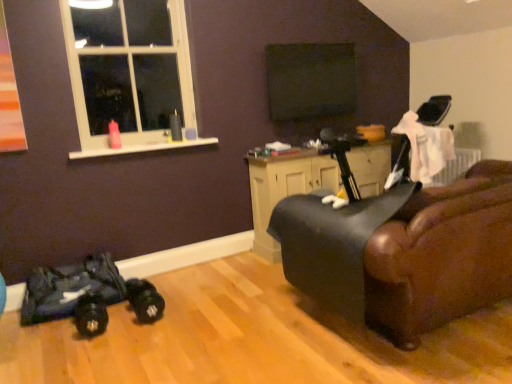
Question: Is black matte screen at upper center looking in the opposite direction of white plastic window at upper left?

Choices:
 (A) yes
 (B) no

Answer: (B)

Question: Considering the relative sizes of black matte screen at upper center and white plastic window at upper left in the image provided, is black matte screen at upper center wider than white plastic window at upper left?

Choices:
 (A) no
 (B) yes

Answer: (A)

Question: Can you confirm if black matte screen at upper center is taller than white plastic window at upper left?

Choices:
 (A) no
 (B) yes

Answer: (A)

Question: Is black matte screen at upper center to the right of white plastic window at upper left from the viewer's perspective?

Choices:
 (A) no
 (B) yes

Answer: (B)

Question: Is black matte screen at upper center closer to the viewer compared to white plastic window at upper left?

Choices:
 (A) yes
 (B) no

Answer: (B)

Question: Is black matte screen at upper center next to white plastic window at upper left and touching it?

Choices:
 (A) yes
 (B) no

Answer: (B)

Question: Is white plastic window at upper left to the right of black matte screen at upper center from the viewer's perspective?

Choices:
 (A) no
 (B) yes

Answer: (A)

Question: From the image's perspective, is white plastic window at upper left on black matte screen at upper center?

Choices:
 (A) no
 (B) yes

Answer: (A)

Question: Would you say white plastic window at upper left is outside black matte screen at upper center?

Choices:
 (A) no
 (B) yes

Answer: (B)

Question: Considering the relative sizes of white plastic window at upper left and black matte screen at upper center in the image provided, is white plastic window at upper left taller than black matte screen at upper center?

Choices:
 (A) no
 (B) yes

Answer: (B)

Question: Is white plastic window at upper left facing away from black matte screen at upper center?

Choices:
 (A) no
 (B) yes

Answer: (A)

Question: From a real-world perspective, is white plastic window at upper left under black matte screen at upper center?

Choices:
 (A) yes
 (B) no

Answer: (B)

Question: From the image's perspective, does matte black cabinet at center appear higher than black leather swivel chair at right?

Choices:
 (A) no
 (B) yes

Answer: (B)